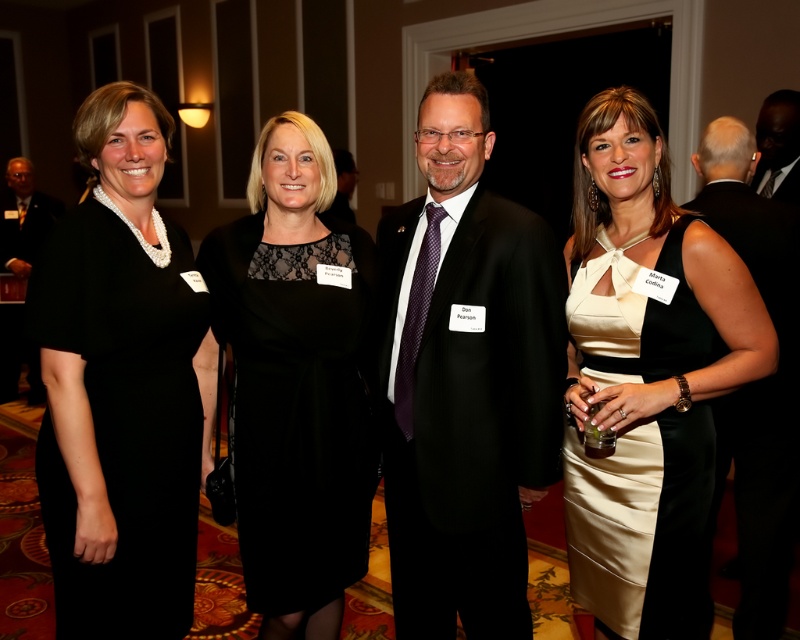
Question: Is matte black suit at center to the left of dark gray wool business suit at center from the viewer's perspective?

Choices:
 (A) yes
 (B) no

Answer: (A)

Question: Does black satin dress at left have a larger size compared to matte black suit at left?

Choices:
 (A) yes
 (B) no

Answer: (B)

Question: Which is farther from the black satin suit at right?

Choices:
 (A) matte black suit at left
 (B) black satin dress at left

Answer: (A)

Question: Is black satin dress at left below black satin suit at right?

Choices:
 (A) yes
 (B) no

Answer: (A)

Question: Which of the following is the closest to the observer?

Choices:
 (A) (44, 497)
 (B) (486, 512)
 (C) (798, 118)
 (D) (794, 180)

Answer: (A)

Question: Which of the following is the closest to the observer?

Choices:
 (A) (141, 394)
 (B) (768, 164)
 (C) (782, 502)
 (D) (17, 250)

Answer: (A)